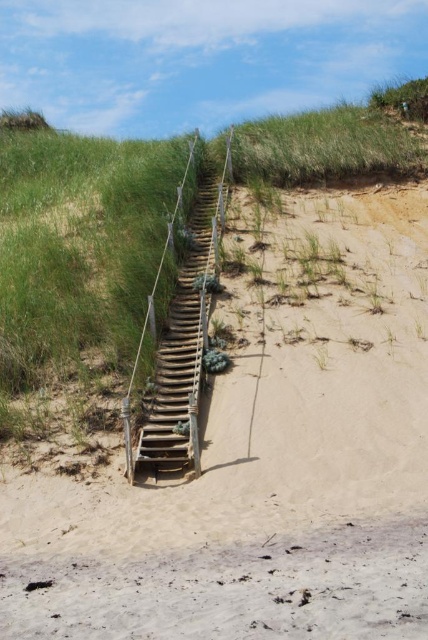
Can you confirm if light brown sandy stairs at center is smaller than wooden stairs at center?

No.

What do you see at coordinates (262, 464) in the screenshot? I see `light brown sandy stairs at center` at bounding box center [262, 464].

You are a GUI agent. You are given a task and a screenshot of the screen. Output one action in this format:
    pyautogui.click(x=<x>, y=<y>)
    Task: Click on the light brown sandy stairs at center
    The width and height of the screenshot is (428, 640).
    Given the screenshot: What is the action you would take?
    pyautogui.click(x=262, y=464)